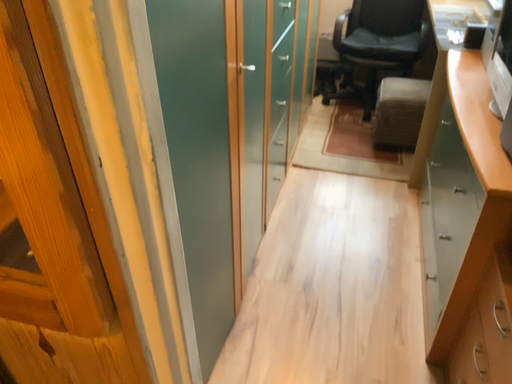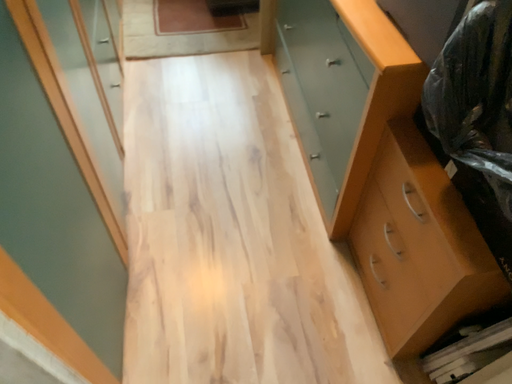
Question: Which way did the camera rotate in the video?

Choices:
 (A) rotated upward
 (B) rotated downward

Answer: (B)